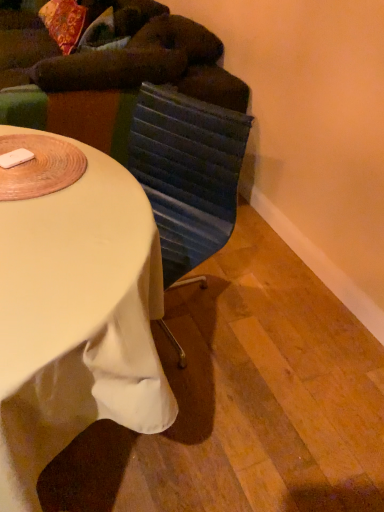
At what (x,y) coordinates should I click in order to perform the action: click on empty space that is ontop of white fabric-covered desk at center. Please return your answer as a coordinate pair (x, y). This screenshot has height=512, width=384. Looking at the image, I should click on (61, 207).